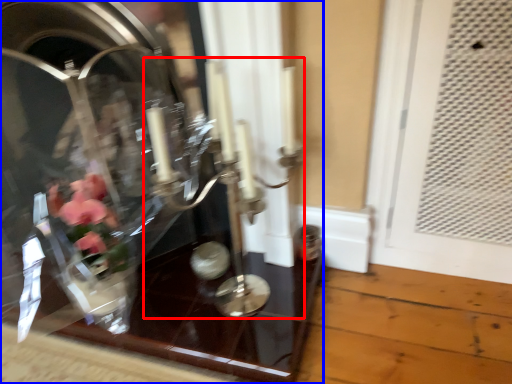
Question: Which point is further to the camera, candle holder (highlighted by a red box) or glass box (highlighted by a blue box)?

Choices:
 (A) candle holder
 (B) glass box

Answer: (B)